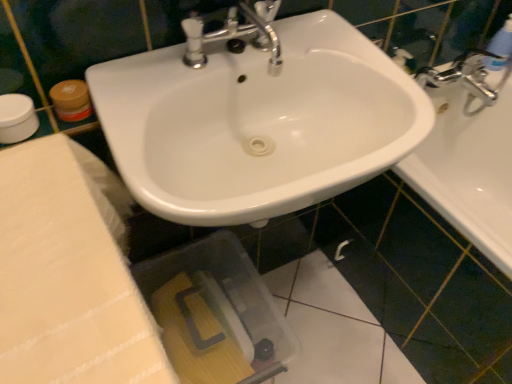
At what (x,y) coordinates should I click in order to perform the action: click on white glossy sink at center. Please return your answer as a coordinate pair (x, y). This screenshot has width=512, height=384. Looking at the image, I should click on (256, 119).

What do you see at coordinates (256, 119) in the screenshot? The image size is (512, 384). I see `white glossy sink at center` at bounding box center [256, 119].

What are the coordinates of `white glossy sink at center` in the screenshot? It's located at (256, 119).